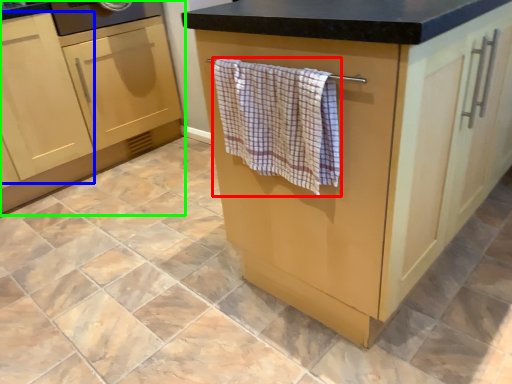
Question: Estimate the real-world distances between objects in this image. Which object is closer to bath towel (highlighted by a red box), cabinetry (highlighted by a blue box) or cabinetry (highlighted by a green box)?

Choices:
 (A) cabinetry
 (B) cabinetry

Answer: (A)